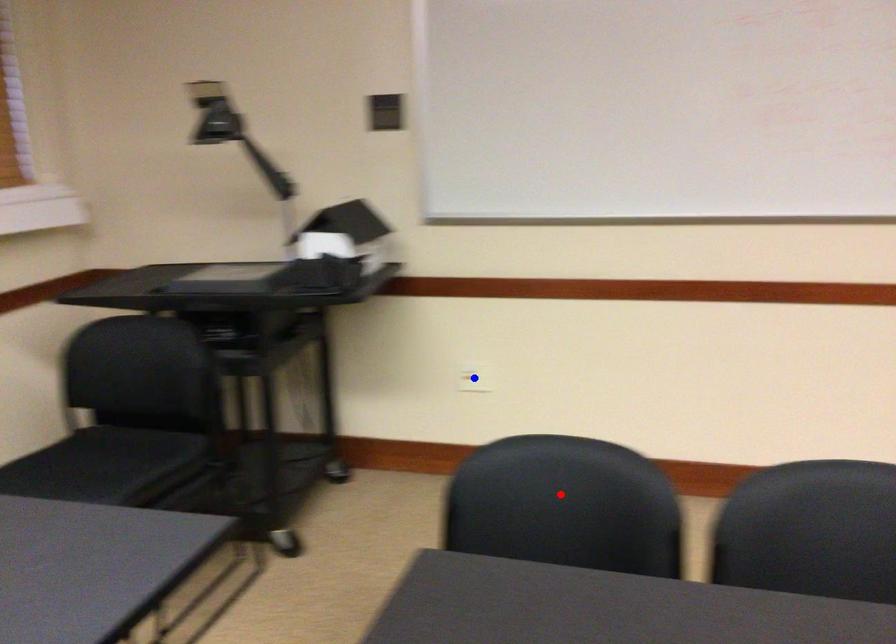
Question: In the image, two points are highlighted. Which point is nearer to the camera? Reply with the corresponding letter.

Choices:
 (A) blue point
 (B) red point

Answer: (B)